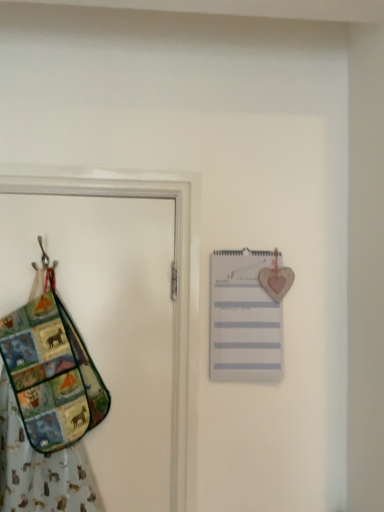
Question: Is multicolored fabric door at left shorter than multicolored fabric handbag at left?

Choices:
 (A) no
 (B) yes

Answer: (A)

Question: From the image's perspective, is multicolored fabric door at left beneath multicolored fabric handbag at left?

Choices:
 (A) no
 (B) yes

Answer: (A)

Question: From a real-world perspective, is multicolored fabric door at left over multicolored fabric handbag at left?

Choices:
 (A) no
 (B) yes

Answer: (B)

Question: Can you confirm if multicolored fabric door at left is wider than multicolored fabric handbag at left?

Choices:
 (A) no
 (B) yes

Answer: (A)

Question: Considering the relative positions of multicolored fabric door at left and multicolored fabric handbag at left in the image provided, is multicolored fabric door at left to the left of multicolored fabric handbag at left from the viewer's perspective?

Choices:
 (A) yes
 (B) no

Answer: (B)

Question: Considering the positions of multicolored fabric door at left and multicolored fabric handbag at left in the image, is multicolored fabric door at left taller or shorter than multicolored fabric handbag at left?

Choices:
 (A) tall
 (B) short

Answer: (A)

Question: Is multicolored fabric door at left bigger or smaller than multicolored fabric handbag at left?

Choices:
 (A) big
 (B) small

Answer: (A)

Question: From a real-world perspective, relative to multicolored fabric handbag at left, is multicolored fabric door at left vertically above or below?

Choices:
 (A) above
 (B) below

Answer: (A)

Question: Is point (155, 493) positioned closer to the camera than point (29, 302)?

Choices:
 (A) farther
 (B) closer

Answer: (A)

Question: Is multicolored fabric handbag at left inside or outside of white paper list at upper right?

Choices:
 (A) inside
 (B) outside

Answer: (B)

Question: Looking at the image, does multicolored fabric handbag at left seem bigger or smaller compared to white paper list at upper right?

Choices:
 (A) small
 (B) big

Answer: (B)

Question: From a real-world perspective, is multicolored fabric handbag at left positioned above or below white paper list at upper right?

Choices:
 (A) above
 (B) below

Answer: (B)

Question: Is multicolored fabric handbag at left taller or shorter than white paper list at upper right?

Choices:
 (A) short
 (B) tall

Answer: (B)

Question: Considering the positions of point (236, 311) and point (125, 508), is point (236, 311) closer or farther from the camera than point (125, 508)?

Choices:
 (A) closer
 (B) farther

Answer: (B)

Question: Do you think white paper list at upper right is within multicolored fabric door at left, or outside of it?

Choices:
 (A) outside
 (B) inside

Answer: (A)